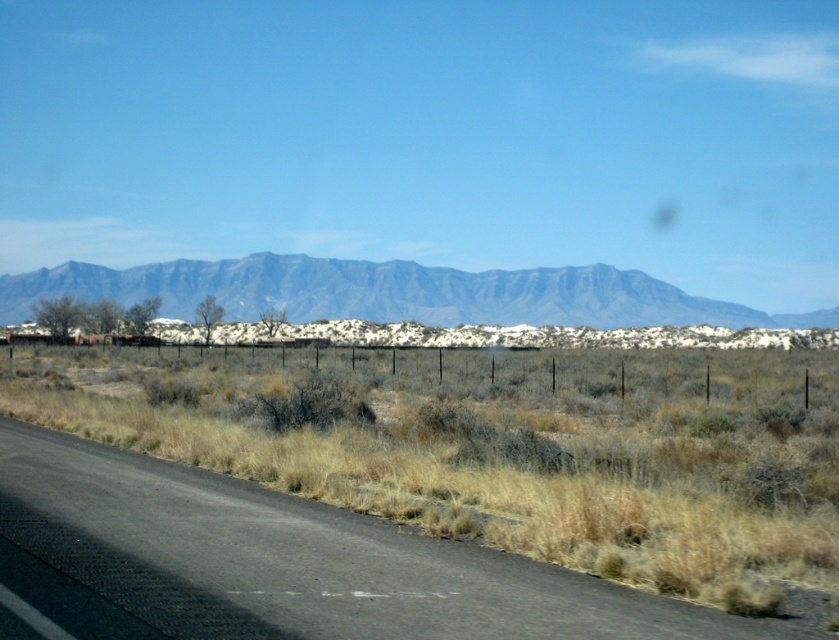
Can you confirm if dry grass at lower center is smaller than gray matte mountain range at center?

→ Yes, dry grass at lower center is smaller than gray matte mountain range at center.

Does dry grass at lower center have a larger size compared to gray matte mountain range at center?

No.

Between point (217, 401) and point (490, 288), which one is positioned behind?

The point (490, 288) is more distant.

You are a GUI agent. You are given a task and a screenshot of the screen. Output one action in this format:
    pyautogui.click(x=<x>, y=<y>)
    Task: Click on the dry grass at lower center
    This screenshot has height=640, width=839.
    Given the screenshot: What is the action you would take?
    pyautogui.click(x=503, y=449)